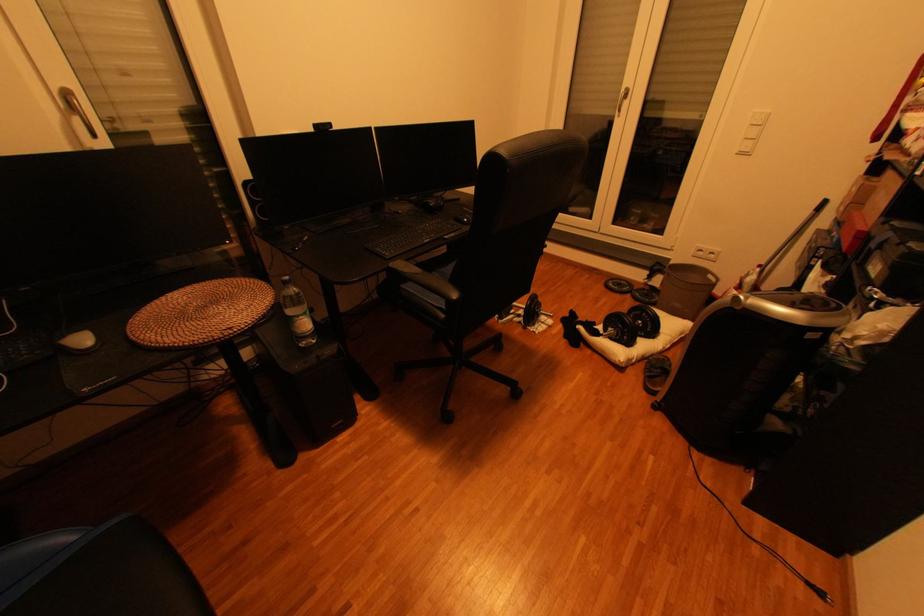
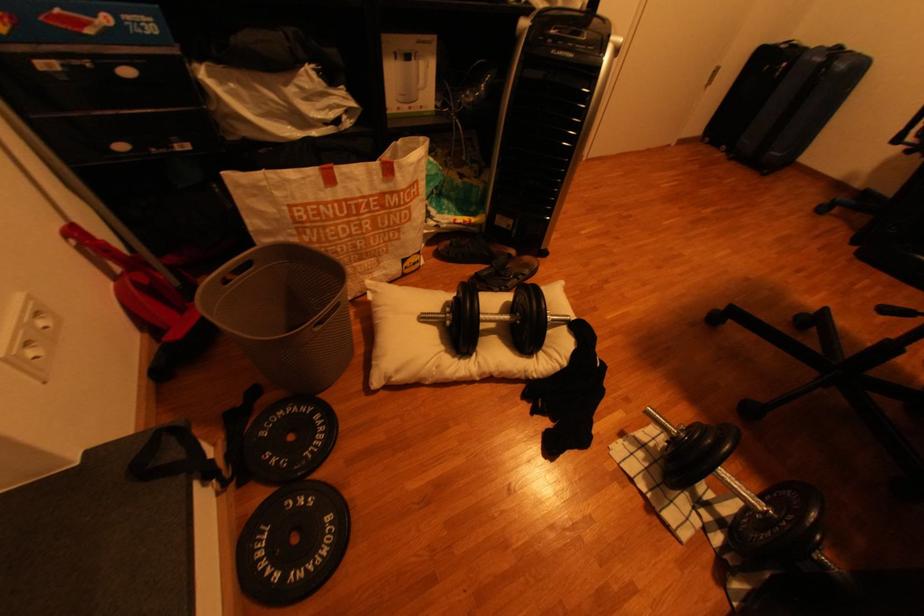
Locate, in the second image, the point that corresponds to point (658, 301) in the first image.

(325, 419)